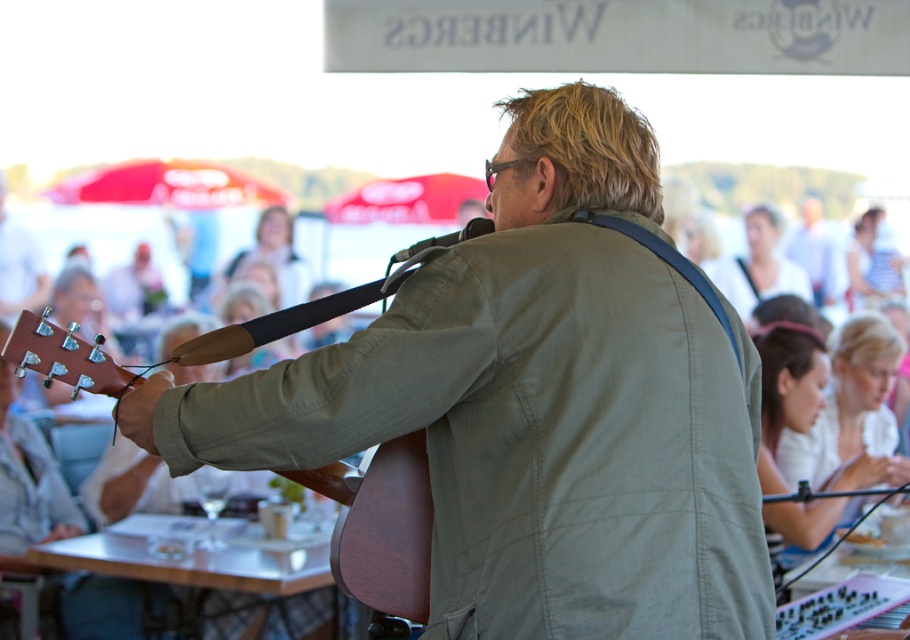
You are standing at the live music performance and want to take a photo of the two points mentioned. Which point, point (x=672, y=544) or point (x=114, y=385), will appear larger in your photo?

Point (x=672, y=544) will appear larger in the photo because it is closer to the viewer than point (x=114, y=385).

You are a photographer at the event and need to capture a clear shot of both the matte brown guitar at center and the wooden acoustic guitar at center. Since the stage is crowded, you can only focus on one guitar at a time. Which guitar should you focus on first to ensure the other is still partially visible in the frame?

The matte brown guitar at center is positioned over the wooden acoustic guitar at center, so focusing on the matte brown guitar at center first will allow the wooden acoustic guitar at center to remain partially visible beneath it.

You are a photographer setting up for a live music shoot. You notice two guitars at the center of the stage, a matte brown guitar at center and a wooden acoustic guitar at center. Which guitar should you focus on if you want to capture the largest instrument in the scene?

The matte brown guitar at center is bigger than the wooden acoustic guitar at center, so you should focus on the matte brown guitar at center to capture the largest instrument in the scene.